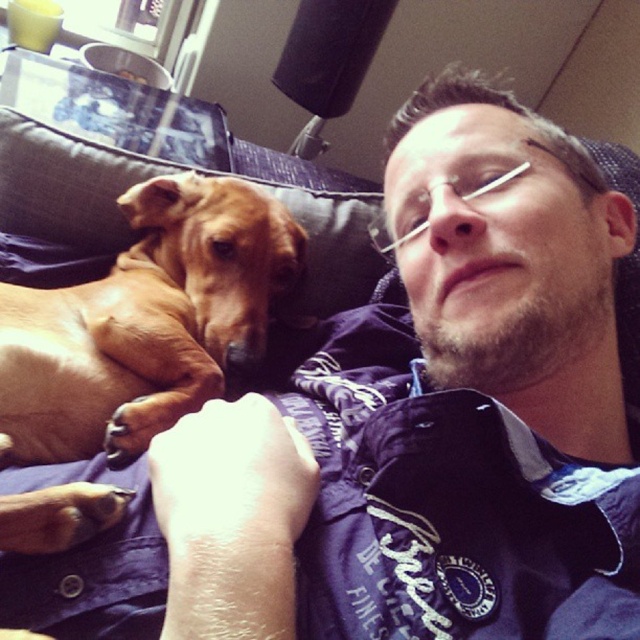
Question: Can you confirm if brown smooth dog at left is positioned above brown fabric pillow at upper left?

Choices:
 (A) yes
 (B) no

Answer: (B)

Question: Does brown smooth dog at left have a larger size compared to brown fabric pillow at upper left?

Choices:
 (A) no
 (B) yes

Answer: (B)

Question: Does brown smooth dog at left have a smaller size compared to brown fabric pillow at upper left?

Choices:
 (A) no
 (B) yes

Answer: (A)